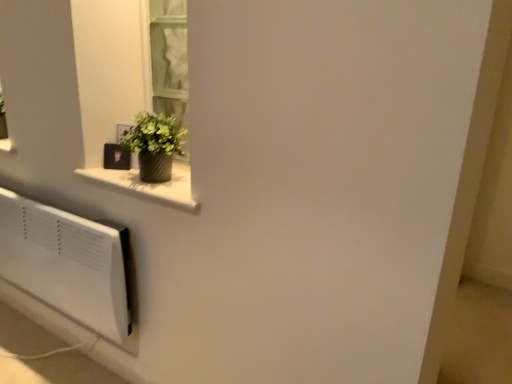
Describe the element at coordinates (154, 145) in the screenshot. I see `green textured vase at upper left` at that location.

Locate an element on the screen. The height and width of the screenshot is (384, 512). green textured vase at upper left is located at coordinates (154, 145).

In order to face green textured vase at upper left, should I rotate leftwards or rightwards?

Rotate your view left by about 14.771°.

Measure the distance between green textured vase at upper left and camera.

green textured vase at upper left is 1.32 meters away from camera.

The image size is (512, 384). Describe the element at coordinates (149, 186) in the screenshot. I see `textured gray vase at upper left` at that location.

I want to click on textured gray vase at upper left, so click(x=149, y=186).

Measure the distance between point (188, 202) and camera.

Point (188, 202) is 4.20 feet from camera.

Locate an element on the screen. This screenshot has height=384, width=512. green textured vase at upper left is located at coordinates (154, 145).

Looking at this image, would you say green textured vase at upper left is to the left or to the right of textured gray vase at upper left in the picture?

Based on their positions, green textured vase at upper left is located to the left of textured gray vase at upper left.

Based on the photo, is green textured vase at upper left positioned behind textured gray vase at upper left?

Yes.

Considering the positions of point (173, 132) and point (125, 173), is point (173, 132) closer or farther from the camera than point (125, 173)?

Point (173, 132) is closer to the camera than point (125, 173).

From the image's perspective, which one is positioned higher, green textured vase at upper left or textured gray vase at upper left?

green textured vase at upper left.

From a real-world perspective, which object rests below the other?

textured gray vase at upper left is physically lower.

Which object is wider, green textured vase at upper left or textured gray vase at upper left?

With larger width is textured gray vase at upper left.

Which of these two, green textured vase at upper left or textured gray vase at upper left, stands taller?

With more height is green textured vase at upper left.

Based on their sizes in the image, would you say green textured vase at upper left is bigger or smaller than textured gray vase at upper left?

In the image, green textured vase at upper left appears to be larger than textured gray vase at upper left.

Consider the image. Is textured gray vase at upper left surrounded by green textured vase at upper left?

Actually, textured gray vase at upper left is outside green textured vase at upper left.

Is green textured vase at upper left beside textured gray vase at upper left?

Indeed, green textured vase at upper left and textured gray vase at upper left are beside each other and touching.

Is green textured vase at upper left oriented away from textured gray vase at upper left?

No, textured gray vase at upper left is not at the back of green textured vase at upper left.

How different are the orientations of green textured vase at upper left and textured gray vase at upper left in degrees?

The angular difference between green textured vase at upper left and textured gray vase at upper left is 0.867 degrees.

How distant is green textured vase at upper left from textured gray vase at upper left?

green textured vase at upper left and textured gray vase at upper left are 3.91 inches apart from each other.

In the image, there is a green textured vase at upper left. Identify the location of window sill below it (from the image's perspective). The width and height of the screenshot is (512, 384). (149, 186).

Does textured gray vase at upper left appear on the left side of green textured vase at upper left?

Incorrect, textured gray vase at upper left is not on the left side of green textured vase at upper left.

Consider the image. Between textured gray vase at upper left and green textured vase at upper left, which one is positioned in front?

textured gray vase at upper left.

Is point (188, 202) more distant than point (170, 139)?

No, it is not.

From the image's perspective, is textured gray vase at upper left on top of green textured vase at upper left?

No, from the image's perspective, textured gray vase at upper left is not over green textured vase at upper left.

From a real-world perspective, who is located higher, textured gray vase at upper left or green textured vase at upper left?

In real-world perspective, green textured vase at upper left is above.

Consider the image. Can you confirm if textured gray vase at upper left is thinner than green textured vase at upper left?

Incorrect, the width of textured gray vase at upper left is not less than that of green textured vase at upper left.

In terms of height, does textured gray vase at upper left look taller or shorter compared to green textured vase at upper left?

Clearly, textured gray vase at upper left is shorter compared to green textured vase at upper left.

Which of these two, textured gray vase at upper left or green textured vase at upper left, is smaller?

textured gray vase at upper left.

Is textured gray vase at upper left completely or partially outside of green textured vase at upper left?

Absolutely, textured gray vase at upper left is external to green textured vase at upper left.

Are textured gray vase at upper left and green textured vase at upper left beside each other?

Yes, the surface of textured gray vase at upper left is in contact with green textured vase at upper left.

Does textured gray vase at upper left turn towards green textured vase at upper left?

No, textured gray vase at upper left is not aimed at green textured vase at upper left.

This screenshot has height=384, width=512. What are the coordinates of `houseplant behind the textured gray vase at upper left` in the screenshot? It's located at (154, 145).

Locate an element on the screen. The height and width of the screenshot is (384, 512). houseplant located behind the textured gray vase at upper left is located at coordinates tap(154, 145).

The image size is (512, 384). Identify the location of window sill below the green textured vase at upper left (from a real-world perspective). (149, 186).